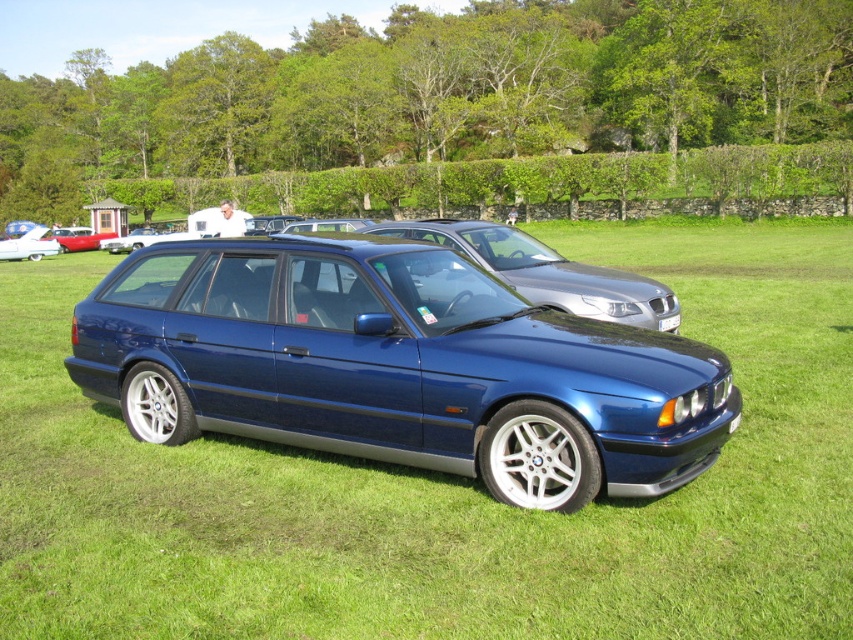
Question: Which point appears closest to the camera in this image?

Choices:
 (A) (480, 243)
 (B) (44, 246)

Answer: (A)

Question: Can you confirm if white glossy car at left is positioned to the left of matte red car at center?

Choices:
 (A) no
 (B) yes

Answer: (B)

Question: Can you confirm if metallic blue station wagon at center is positioned below white glossy car at left?

Choices:
 (A) yes
 (B) no

Answer: (A)

Question: Is metallic blue station wagon at center behind white plastic license plate at center?

Choices:
 (A) yes
 (B) no

Answer: (B)

Question: Which point is farther to the camera?

Choices:
 (A) (103, 234)
 (B) (505, 264)
 (C) (671, 320)

Answer: (A)

Question: Which is nearer to the white glossy sedan at center?

Choices:
 (A) metallic blue station wagon at center
 (B) white glossy car at left

Answer: (B)